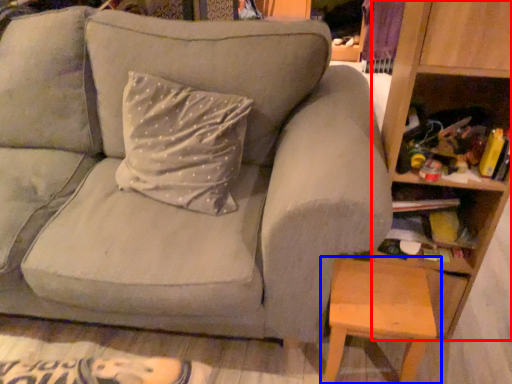
Question: Among these objects, which one is nearest to the camera, bookshelf (highlighted by a red box) or table (highlighted by a blue box)?

Choices:
 (A) bookshelf
 (B) table

Answer: (A)